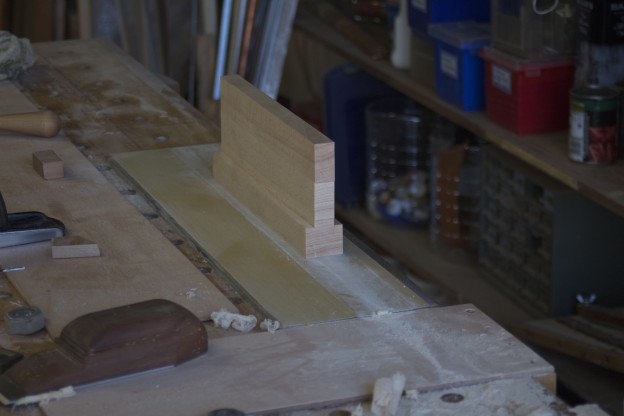
Where is `organizer`? The width and height of the screenshot is (624, 416). organizer is located at coordinates (515, 226).